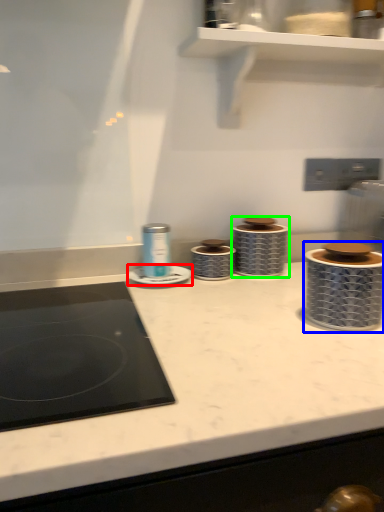
Question: Which object is positioned closest to appliance (highlighted by a red box)? Select from appliance (highlighted by a blue box) and appliance (highlighted by a green box).

Choices:
 (A) appliance
 (B) appliance

Answer: (B)